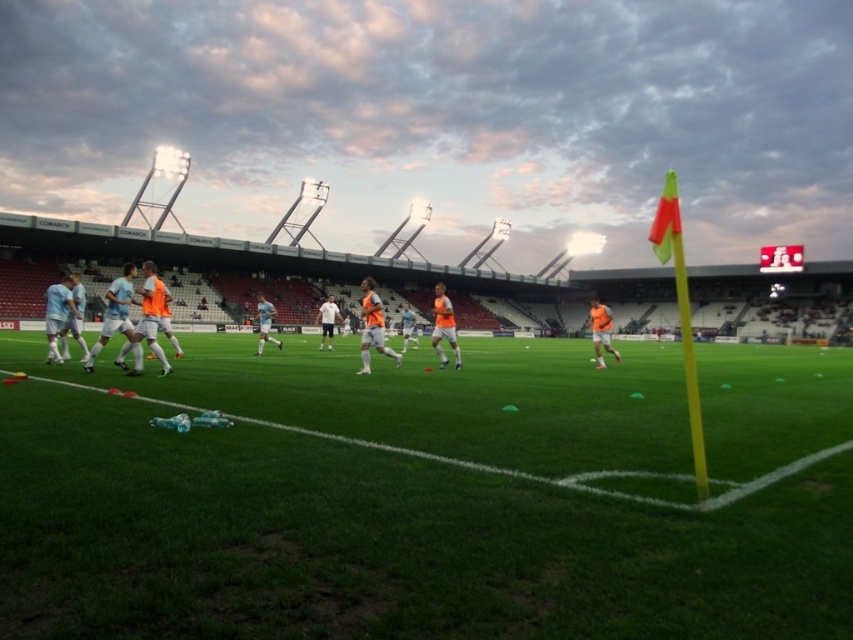
Question: Can you confirm if green grass at center is positioned below orange mesh vest at center?

Choices:
 (A) no
 (B) yes

Answer: (B)

Question: Does green grass at center appear on the right side of orange matte jersey at right?

Choices:
 (A) no
 (B) yes

Answer: (A)

Question: Which point is farther from the camera taking this photo?

Choices:
 (A) 436,321
 (B) 375,346

Answer: (A)

Question: Can you confirm if light blue fabric soccer players at left is positioned below orange mesh vest at center?

Choices:
 (A) no
 (B) yes

Answer: (A)

Question: Estimate the real-world distances between objects in this image. Which object is farther from the orange matte jersey at right?

Choices:
 (A) light blue fabric soccer players at left
 (B) orange mesh vest at center
 (C) green grass at center
 (D) orange fabric jersey at center

Answer: (A)

Question: Which point is farther to the camera?

Choices:
 (A) orange mesh vest at center
 (B) light blue fabric soccer players at left
 (C) orange fabric jersey at center

Answer: (A)